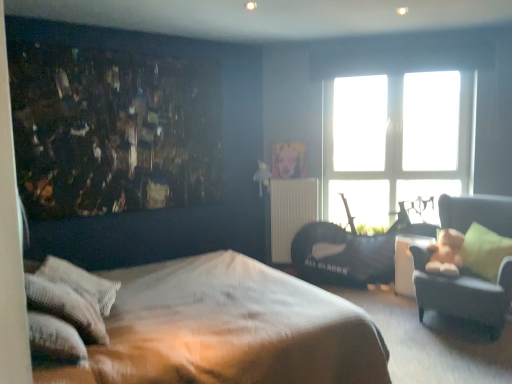
Locate an element on the screen. This screenshot has width=512, height=384. transparent glass window at upper center is located at coordinates (395, 129).

This screenshot has height=384, width=512. Describe the element at coordinates (81, 282) in the screenshot. I see `white textured pillow at lower left, the 2th pillow viewed from the front` at that location.

Describe the element at coordinates (228, 329) in the screenshot. I see `brown textured bed at center` at that location.

This screenshot has width=512, height=384. What do you see at coordinates (350, 252) in the screenshot?
I see `black leather swivel chair at right` at bounding box center [350, 252].

This screenshot has width=512, height=384. Describe the element at coordinates (485, 251) in the screenshot. I see `green fabric pillow at right, arranged as the 1th pillow when viewed from the back` at that location.

At what (x,y) coordinates should I click in order to perform the action: click on transparent glass window at upper center. Please return your answer as a coordinate pair (x, y). The width and height of the screenshot is (512, 384). Looking at the image, I should click on (395, 129).

In the image, there is a transparent glass window at upper center. Where is `radiator below it (from the image's perspective)`? radiator below it (from the image's perspective) is located at coordinates (292, 212).

From the image's perspective, is transparent glass window at upper center located above or below metallic gold radiator at center?

Based on their image positions, transparent glass window at upper center is located above metallic gold radiator at center.

Are transparent glass window at upper center and metallic gold radiator at center beside each other?

No, transparent glass window at upper center is not beside metallic gold radiator at center.

Is transparent glass window at upper center further to camera compared to metallic gold radiator at center?

No, transparent glass window at upper center is closer to the viewer.

Find the location of `chair on the right of metallic gold radiator at center`. chair on the right of metallic gold radiator at center is located at coordinates (464, 295).

Based on the photo, is velvet green armchair at right next to metallic gold radiator at center?

There is a gap between velvet green armchair at right and metallic gold radiator at center.

Is velvet green armchair at right bigger or smaller than metallic gold radiator at center?

In the image, velvet green armchair at right appears to be larger than metallic gold radiator at center.

From the picture: Considering the relative sizes of transparent glass window at upper center and white textured pillow at lower left, the second pillow in the back-to-front sequence, in the image provided, is transparent glass window at upper center thinner than white textured pillow at lower left, the second pillow in the back-to-front sequence,?

Indeed, transparent glass window at upper center has a lesser width compared to white textured pillow at lower left, the second pillow in the back-to-front sequence.

In the scene shown: Would you say transparent glass window at upper center is a long distance from white textured pillow at lower left, the third pillow in the right-to-left sequence?

That's right, there is a large distance between transparent glass window at upper center and white textured pillow at lower left, the third pillow in the right-to-left sequence.

Which is more to the left, transparent glass window at upper center or white textured pillow at lower left, the third pillow in the right-to-left sequence?

white textured pillow at lower left, the third pillow in the right-to-left sequence.

Is white textured pillow at lower left, the first pillow in the left-to-right sequence, at the back of transparent glass window at upper center?

transparent glass window at upper center does not have its back to white textured pillow at lower left, the first pillow in the left-to-right sequence.

From the image's perspective, is green fabric pillow at right, the third pillow from the front, located above or below white textured pillow at lower left, which ranks as the 3th pillow in back-to-front order?

Clearly, from the image's perspective, green fabric pillow at right, the third pillow from the front, is above white textured pillow at lower left, which ranks as the 3th pillow in back-to-front order.

The width and height of the screenshot is (512, 384). In order to click on pillow that is the 2nd object above the green fabric pillow at right, arranged as the 1th pillow when viewed from the back (from a real-world perspective) in this screenshot , I will do `click(66, 307)`.

Consider the image. How many degrees apart are the facing directions of green fabric pillow at right, the third pillow from the front, and white textured pillow at lower left, the first pillow viewed from the front?

There is a 179-degree angle between the facing directions of green fabric pillow at right, the third pillow from the front, and white textured pillow at lower left, the first pillow viewed from the front.

Between green fabric pillow at right, marked as the third pillow in a left-to-right arrangement, and white textured pillow at lower left, which ranks as the 3th pillow in back-to-front order, which one has larger size?

Bigger between the two is green fabric pillow at right, marked as the third pillow in a left-to-right arrangement.

What's the angular difference between white glossy table at right and white textured pillow at lower left, the first pillow viewed from the front,'s facing directions?

167 degrees separate the facing orientations of white glossy table at right and white textured pillow at lower left, the first pillow viewed from the front.

Would you say white textured pillow at lower left, the first pillow viewed from the front, is part of white glossy table at right's contents?

No, white textured pillow at lower left, the first pillow viewed from the front, is not inside white glossy table at right.

Measure the distance from white glossy table at right to white textured pillow at lower left, marked as the second pillow in a right-to-left arrangement.

A distance of 9.64 feet exists between white glossy table at right and white textured pillow at lower left, marked as the second pillow in a right-to-left arrangement.

In the scene shown: Is white glossy table at right aimed at white textured pillow at lower left, the second pillow when ordered from left to right?

Yes, white glossy table at right is turned towards white textured pillow at lower left, the second pillow when ordered from left to right.

Where is `table on the left of green fabric pillow at right, the third pillow from the front`? table on the left of green fabric pillow at right, the third pillow from the front is located at coordinates (407, 262).

Does green fabric pillow at right, the third pillow from the front, have a greater height compared to white glossy table at right?

Yes.

Could you tell me if green fabric pillow at right, the third pillow from the front, is turned towards white glossy table at right?

No, green fabric pillow at right, the third pillow from the front, does not turn towards white glossy table at right.

Is white glossy table at right inside green fabric pillow at right, marked as the third pillow in a left-to-right arrangement?

Actually, white glossy table at right is outside green fabric pillow at right, marked as the third pillow in a left-to-right arrangement.

Is white glossy table at right bigger than green fabric pillow at right, arranged as the 1th pillow when viewed from the back?

No, white glossy table at right is not bigger than green fabric pillow at right, arranged as the 1th pillow when viewed from the back.

Based on the photo, measure the distance from white glossy table at right to green fabric pillow at right, marked as the third pillow in a left-to-right arrangement.

The distance of white glossy table at right from green fabric pillow at right, marked as the third pillow in a left-to-right arrangement, is 21.38 inches.

Considering the relative sizes of white glossy table at right and green fabric pillow at right, the third pillow from the front, in the image provided, is white glossy table at right wider than green fabric pillow at right, the third pillow from the front,?

No, white glossy table at right is not wider than green fabric pillow at right, the third pillow from the front.

Considering the relative positions of white glossy table at right and green fabric pillow at right, arranged as the 1th pillow when viewed from the back, in the image provided, is white glossy table at right to the left or to the right of green fabric pillow at right, arranged as the 1th pillow when viewed from the back,?

In the image, white glossy table at right appears on the left side of green fabric pillow at right, arranged as the 1th pillow when viewed from the back.

Identify the location of radiator below the transparent glass window at upper center (from a real-world perspective). This screenshot has width=512, height=384. (292, 212).

Where is `chair located on the right of metallic gold radiator at center`? chair located on the right of metallic gold radiator at center is located at coordinates (464, 295).

Consider the image. Based on their spatial positions, is white glossy table at right or white textured pillow at lower left, which ranks as the 3th pillow in back-to-front order, further from velvet green armchair at right?

white textured pillow at lower left, which ranks as the 3th pillow in back-to-front order.

Based on their spatial positions, is white glossy table at right or green fabric pillow at right, arranged as the first pillow when viewed from the right, closer to white textured pillow at lower left, the first pillow viewed from the front?

white glossy table at right.

When comparing their distances from velvet green armchair at right, does black leather swivel chair at right or green fabric pillow at right, marked as the third pillow in a left-to-right arrangement, seem closer?

The object closer to velvet green armchair at right is green fabric pillow at right, marked as the third pillow in a left-to-right arrangement.

Considering their positions, is white textured pillow at lower left, the first pillow viewed from the front, positioned closer to velvet green armchair at right than white textured pillow at lower left, the first pillow in the left-to-right sequence?

The object closer to velvet green armchair at right is white textured pillow at lower left, the first pillow in the left-to-right sequence.

Looking at the image, which one is located further to velvet green armchair at right, white textured pillow at lower left, which ranks as the 3th pillow in back-to-front order, or brown textured bed at center?

white textured pillow at lower left, which ranks as the 3th pillow in back-to-front order, is further to velvet green armchair at right.

Which object lies nearer to the anchor point velvet green armchair at right, white glossy table at right or green fabric pillow at right, arranged as the 1th pillow when viewed from the back?

green fabric pillow at right, arranged as the 1th pillow when viewed from the back, is positioned closer to the anchor velvet green armchair at right.

Estimate the real-world distances between objects in this image. Which object is closer to metallic gold radiator at center, white textured pillow at lower left, the first pillow in the left-to-right sequence, or brown textured bed at center?

Based on the image, brown textured bed at center appears to be nearer to metallic gold radiator at center.

Which object lies further to the anchor point green fabric pillow at right, the third pillow from the front, brown textured bed at center or transparent glass window at upper center?

brown textured bed at center is positioned further to the anchor green fabric pillow at right, the third pillow from the front.

You are a GUI agent. You are given a task and a screenshot of the screen. Output one action in this format:
    pyautogui.click(x=<x>, y=<y>)
    Task: Click on the table between velvet green armchair at right and metallic gold radiator at center in the front-back direction
    
    Given the screenshot: What is the action you would take?
    pyautogui.click(x=407, y=262)

At what (x,y) coordinates should I click in order to perform the action: click on swivel chair between white textured pillow at lower left, the second pillow in the back-to-front sequence, and transparent glass window at upper center. Please return your answer as a coordinate pair (x, y). This screenshot has width=512, height=384. Looking at the image, I should click on (350, 252).

The width and height of the screenshot is (512, 384). Find the location of `pillow between white textured pillow at lower left, the third pillow in the right-to-left sequence, and green fabric pillow at right, arranged as the first pillow when viewed from the right, from left to right`. pillow between white textured pillow at lower left, the third pillow in the right-to-left sequence, and green fabric pillow at right, arranged as the first pillow when viewed from the right, from left to right is located at coordinates (66, 307).

Identify the location of table between metallic gold radiator at center and green fabric pillow at right, arranged as the first pillow when viewed from the right, from left to right. (407, 262).